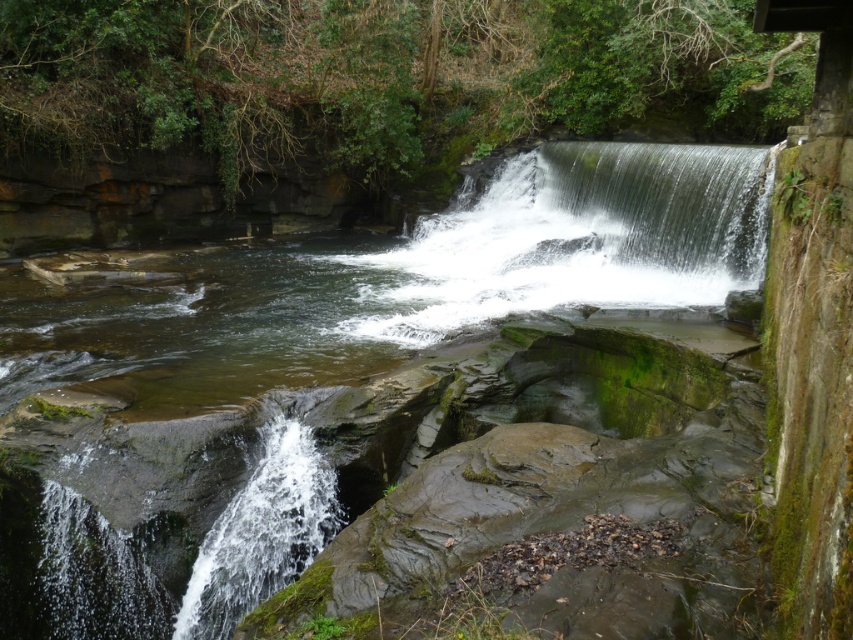
Is clear water at center positioned before green mossy rock at center?

Yes, clear water at center is closer to the viewer.

Identify the location of clear water at center. This screenshot has height=640, width=853. (402, 280).

In order to click on clear water at center in this screenshot , I will do `click(402, 280)`.